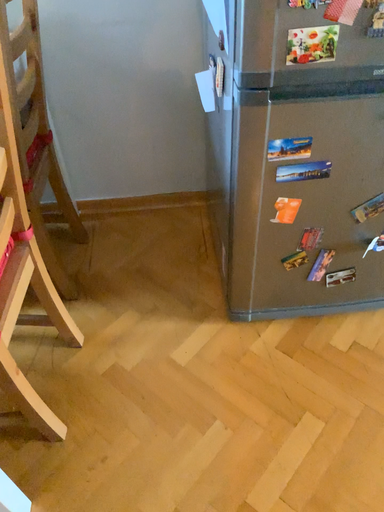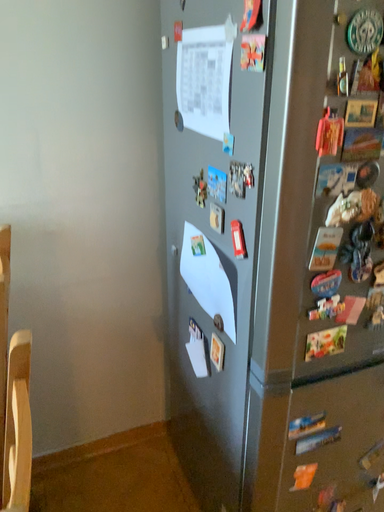
Question: How did the camera likely rotate when shooting the video?

Choices:
 (A) rotated right
 (B) rotated left

Answer: (A)